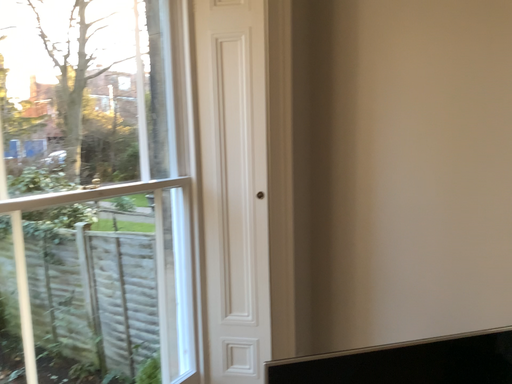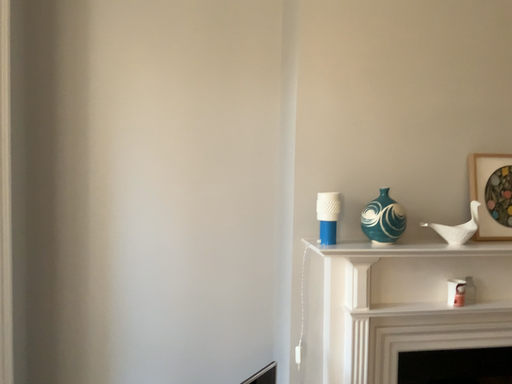
Question: How did the camera likely rotate when shooting the video?

Choices:
 (A) rotated left
 (B) rotated right

Answer: (B)